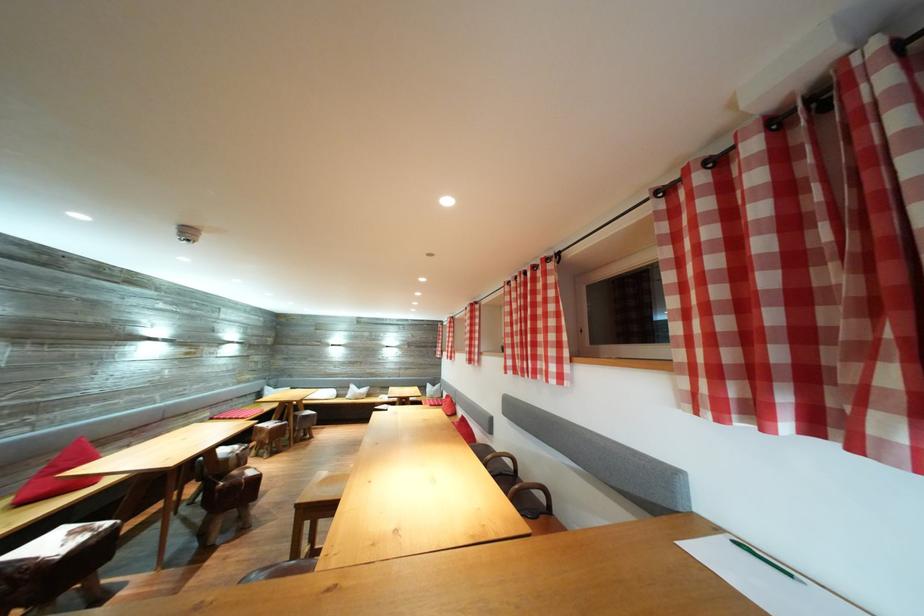
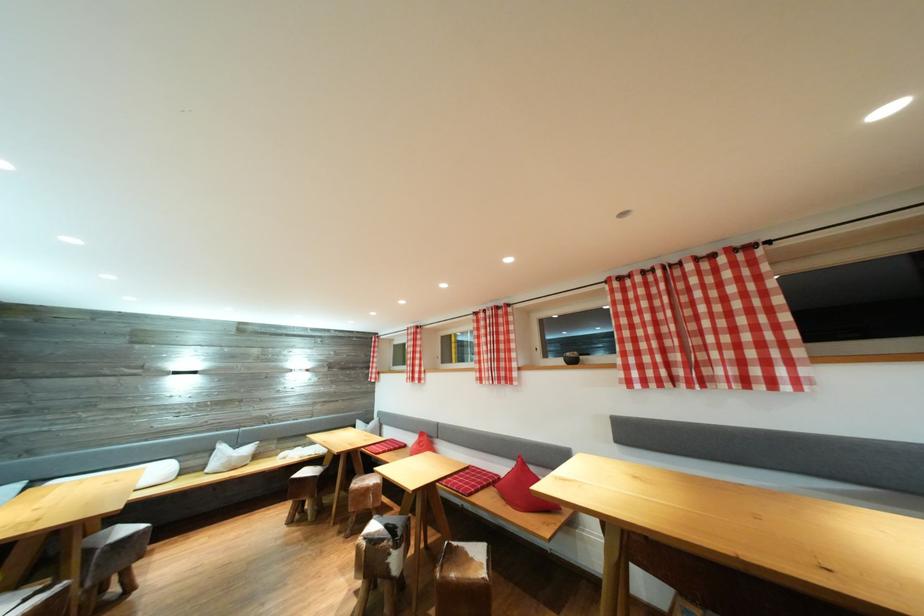
Where in the second image is the point corresponding to (x=332, y=400) from the first image?

(161, 483)